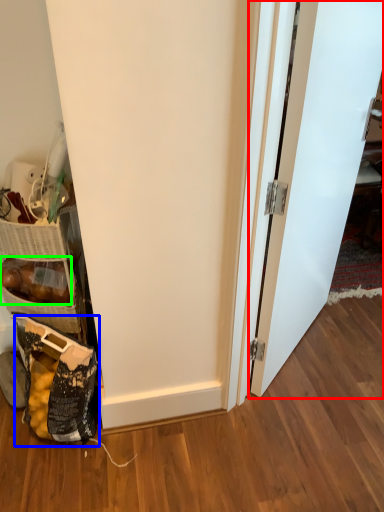
Question: Estimate the real-world distances between objects in this image. Which object is farther from door (highlighted by a red box), material (highlighted by a blue box) or stuff (highlighted by a green box)?

Choices:
 (A) material
 (B) stuff

Answer: (B)